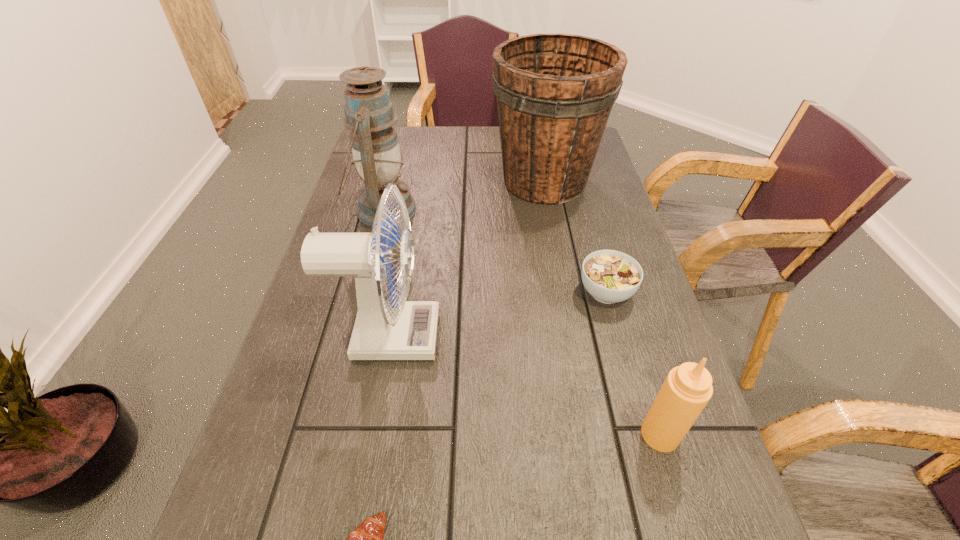
This screenshot has width=960, height=540. Find the location of `vacant space at the right edge of the desktop`. vacant space at the right edge of the desktop is located at coordinates (576, 282).

This screenshot has height=540, width=960. Identify the location of vacant space at the far left corner. (406, 136).

Image resolution: width=960 pixels, height=540 pixels. I want to click on free space between the fan and the bucket, so click(x=467, y=259).

You are a GUI agent. You are given a task and a screenshot of the screen. Output one action in this format:
    pyautogui.click(x=<x>, y=<y>)
    Task: Click on the free spot between the soup bowl and the fan
    This screenshot has height=540, width=960.
    Given the screenshot: What is the action you would take?
    (x=497, y=314)

Locate an element on the screen. vacant area between the bucket and the fan is located at coordinates (467, 259).

Image resolution: width=960 pixels, height=540 pixels. What are the coordinates of `free spot between the bucket and the fan` in the screenshot? It's located at (467, 259).

In order to click on object that is the fourth nearest to the bucket in this screenshot , I will do `click(687, 389)`.

Identify which object is the second closest to the crescent roll. Please provide its 2D coordinates. Your answer should be formatted as a tuple, i.e. [(x, y)], where the tuple contains the x and y coordinates of a point satisfying the conditions above.

[(687, 389)]

Where is `vacant area that satisfies the following two spatial constraints: 1. on the front side of the soup bowl; 2. on the left side of the fourth tallest object`? This screenshot has height=540, width=960. vacant area that satisfies the following two spatial constraints: 1. on the front side of the soup bowl; 2. on the left side of the fourth tallest object is located at coordinates (645, 434).

Where is `free space that satisfies the following two spatial constraints: 1. on the back side of the condiment; 2. on the front-facing side of the fan`? free space that satisfies the following two spatial constraints: 1. on the back side of the condiment; 2. on the front-facing side of the fan is located at coordinates (631, 336).